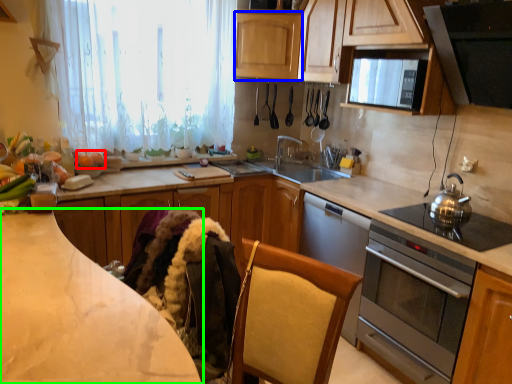
Question: Estimate the real-world distances between objects in this image. Which object is closer to food (highlighted by a red box), cabinetry (highlighted by a blue box) or countertop (highlighted by a green box)?

Choices:
 (A) cabinetry
 (B) countertop

Answer: (A)